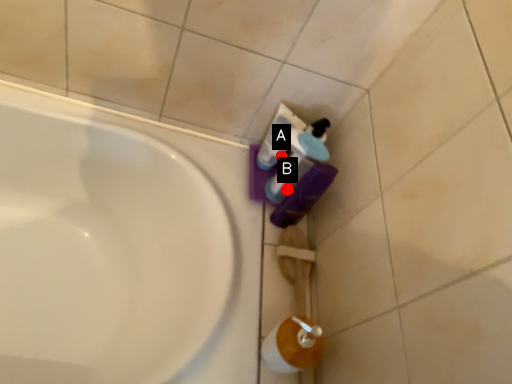
Question: Two points are circled on the image, labeled by A and B beside each circle. Which of the following is the closest to the observer?

Choices:
 (A) A is closer
 (B) B is closer

Answer: (B)